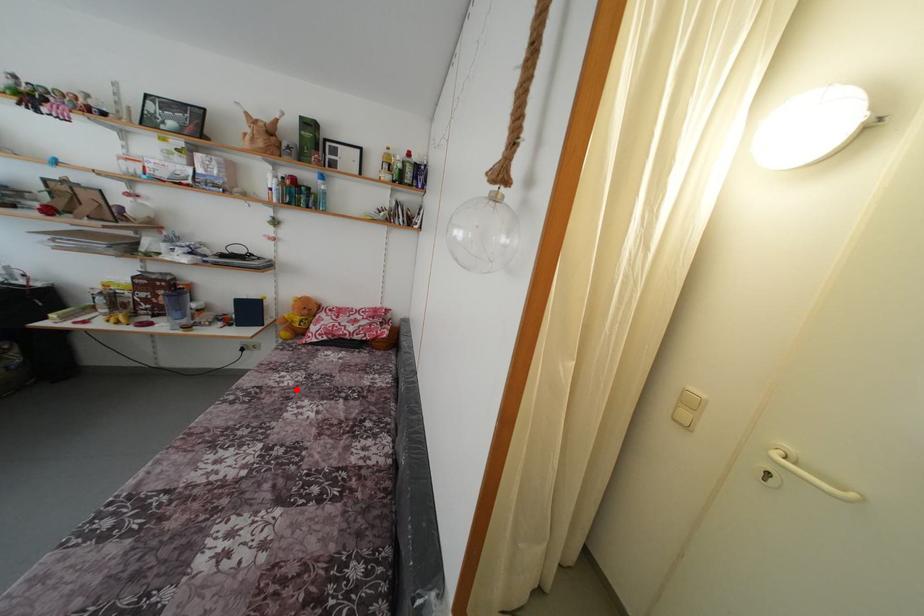
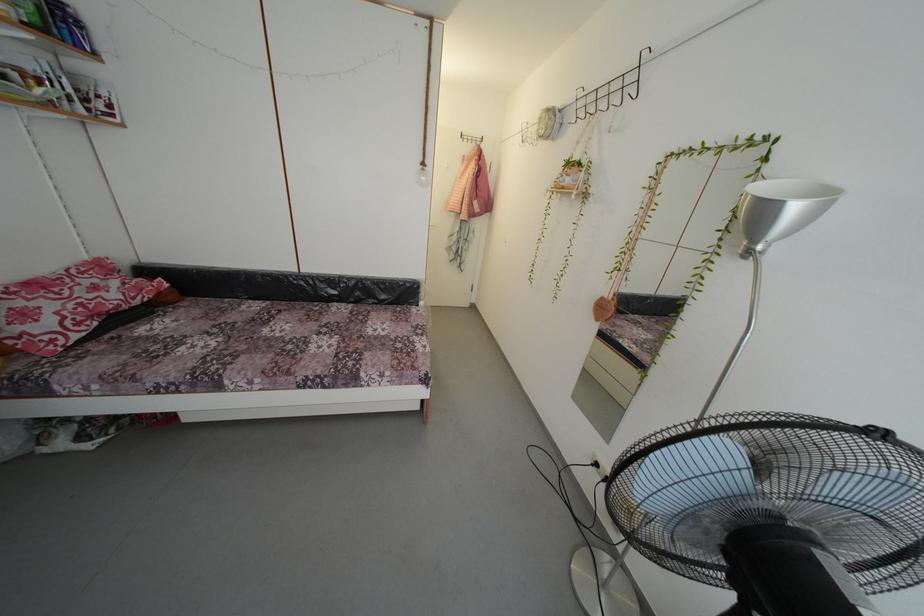
Question: I am providing you with two images of the same scene from different viewpoints. A red point is marked on the first image. Is the red point's position out of view in image 2?

Choices:
 (A) Yes
 (B) No

Answer: (B)